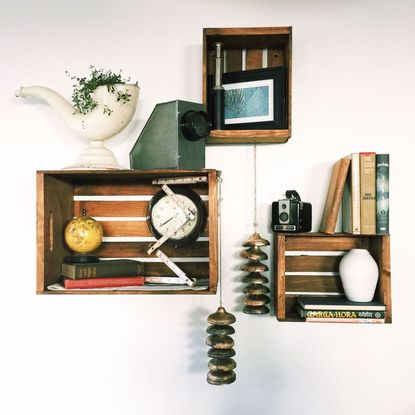
Identify the location of book. (322, 313).